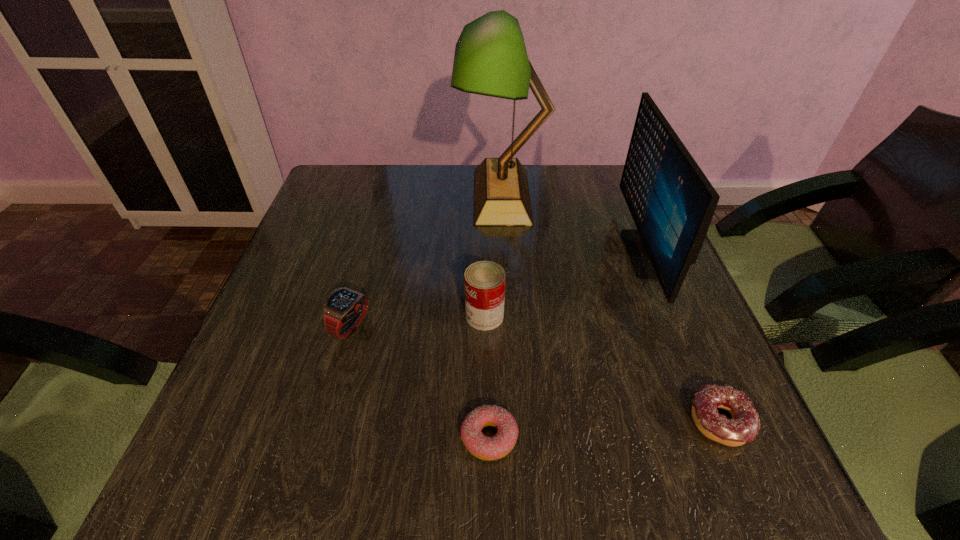
Where is `table lamp`? This screenshot has height=540, width=960. table lamp is located at coordinates (490, 59).

I want to click on computer monitor, so click(672, 203).

At what (x,y) coordinates should I click in order to perform the action: click on can. Please return your answer as a coordinate pair (x, y). The image size is (960, 540). Looking at the image, I should click on (485, 281).

This screenshot has height=540, width=960. In order to click on watch in this screenshot , I will do `click(344, 308)`.

Find the location of a particular element. the third shortest object is located at coordinates (344, 308).

Where is `the right doughnut`? the right doughnut is located at coordinates pos(744,425).

You are a GUI agent. You are given a task and a screenshot of the screen. Output one action in this format:
    pyautogui.click(x=<x>, y=<y>)
    Task: Click on the second shortest object
    This screenshot has width=960, height=540.
    Given the screenshot: What is the action you would take?
    pyautogui.click(x=744, y=425)

Identify the location of the shortest object. (483, 447).

Identify the location of the shorter doughnut. (483, 447).

This screenshot has height=540, width=960. In order to click on vacant space located on the metallic stand of the table lamp in this screenshot , I will do `click(345, 196)`.